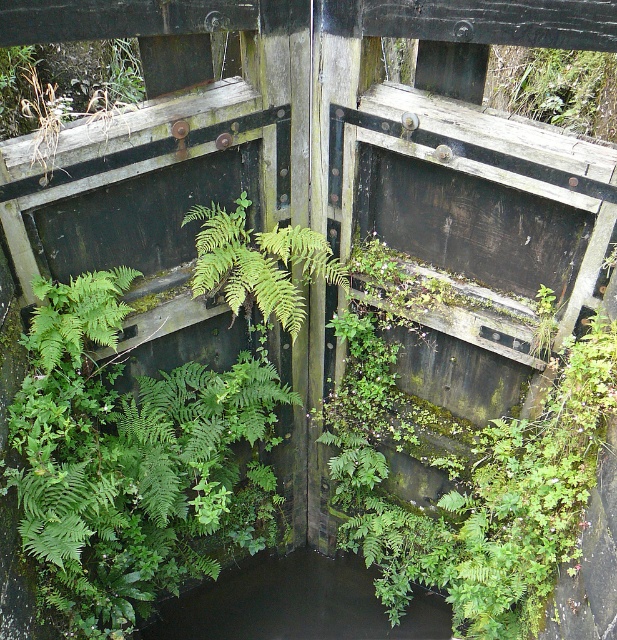
Who is more forward, (x=590, y=132) or (x=59, y=332)?

Point (x=59, y=332)

Can you confirm if green leafy plant at upper center is positioned to the right of green leafy fern at left?

Yes, green leafy plant at upper center is to the right of green leafy fern at left.

Which is in front, point (499, 77) or point (130, 282)?

Positioned in front is point (130, 282).

You are a GUI agent. You are given a task and a screenshot of the screen. Output one action in this format:
    pyautogui.click(x=<x>, y=<y>)
    Task: Click on the green leafy plant at upper center
    
    Given the screenshot: What is the action you would take?
    pyautogui.click(x=555, y=86)

Can you confirm if dark liquid water at center is taller than green leafy fern at center?

Correct, dark liquid water at center is much taller as green leafy fern at center.

Is point (317, 625) behind point (188, 218)?

Yes, it is behind point (188, 218).

This screenshot has width=617, height=640. What do you see at coordinates (294, 604) in the screenshot?
I see `dark liquid water at center` at bounding box center [294, 604].

This screenshot has height=640, width=617. Find the location of `dark liquid water at center`. dark liquid water at center is located at coordinates (294, 604).

Is green leafy fern at center taller than green leafy plant at upper center?

Indeed, green leafy fern at center has a greater height compared to green leafy plant at upper center.

Describe the element at coordinates (259, 262) in the screenshot. The image size is (617, 640). I see `green leafy fern at center` at that location.

Locate an element on the screen. The image size is (617, 640). green leafy fern at center is located at coordinates (259, 262).

You are a GUI agent. You are given a task and a screenshot of the screen. Output one action in this format:
    pyautogui.click(x=<x>, y=<y>)
    Task: Click on the green leafy fern at center
    
    Given the screenshot: What is the action you would take?
    pyautogui.click(x=259, y=262)